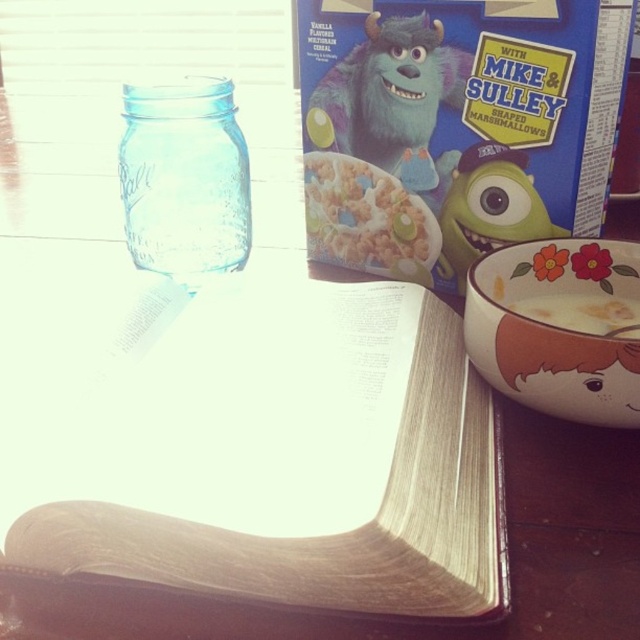
Question: Which of the following is the closest to the observer?

Choices:
 (A) (205, 525)
 (B) (237, 257)
 (C) (396, 232)
 (D) (605, 294)

Answer: (A)

Question: Which point is farther to the camera?

Choices:
 (A) (554, 298)
 (B) (602, 356)
 (C) (42, 531)

Answer: (A)

Question: Can you confirm if white textured cereal at center is smaller than white creamy cereal at lower right?

Choices:
 (A) no
 (B) yes

Answer: (A)

Question: Is light brown paper book at center above white textured cereal at center?

Choices:
 (A) no
 (B) yes

Answer: (A)

Question: Is porcelain floral bowl at lower right below transparent glass jar at upper left?

Choices:
 (A) yes
 (B) no

Answer: (A)

Question: Considering the real-world distances, which object is closest to the white creamy cereal at lower right?

Choices:
 (A) white textured cereal at center
 (B) light brown paper book at center

Answer: (A)